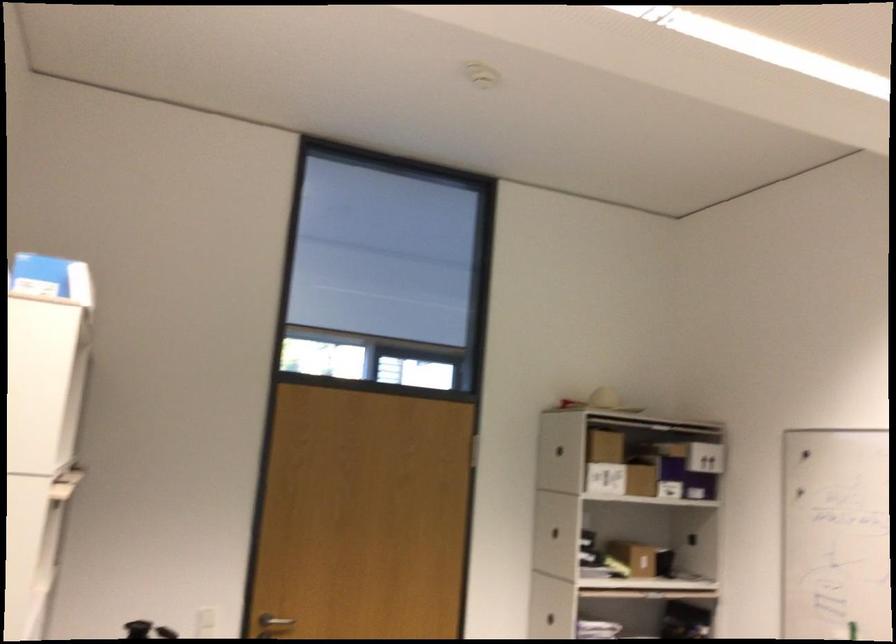
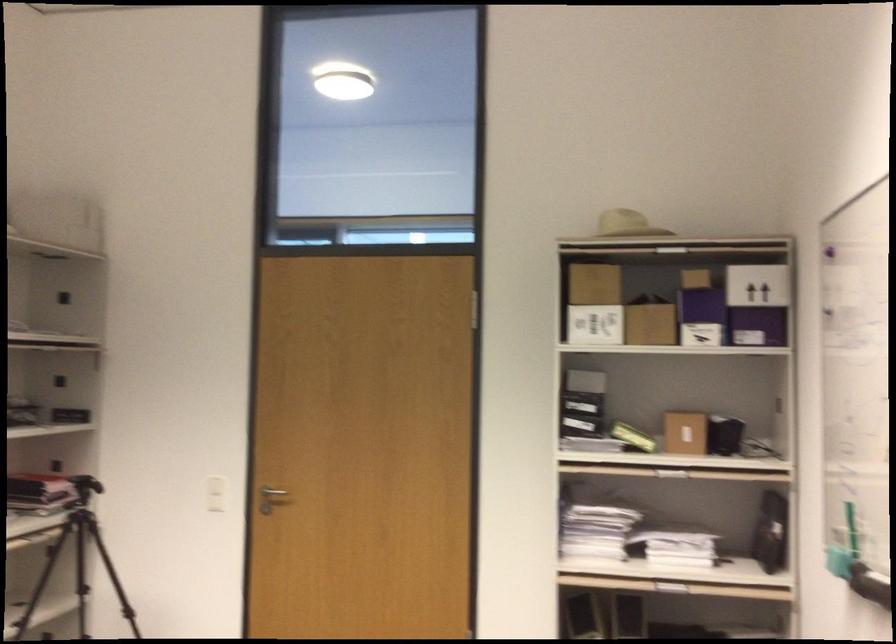
The point at (602, 569) is marked in the first image. Where is the corresponding point in the second image?

(633, 437)